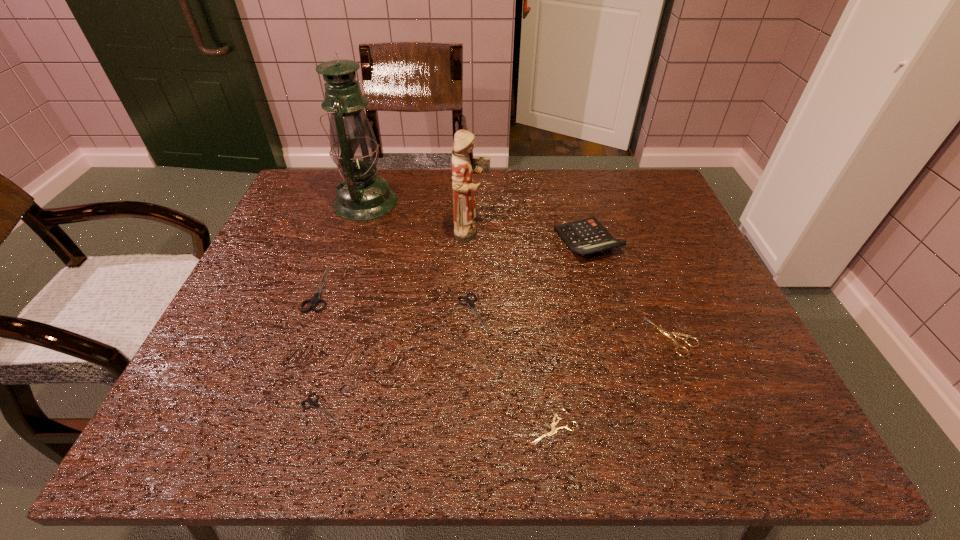
The width and height of the screenshot is (960, 540). Find the location of `free spot located on the left of the smaller beige shears`. free spot located on the left of the smaller beige shears is located at coordinates [502, 427].

At what (x,y) coordinates should I click in order to perform the action: click on object located in the far edge section of the desktop. Please return your answer as a coordinate pair (x, y). This screenshot has width=960, height=540. Looking at the image, I should click on (362, 195).

I want to click on oil lamp that is at the left edge, so click(x=362, y=195).

Image resolution: width=960 pixels, height=540 pixels. Find the location of `shears present at the left edge`. shears present at the left edge is located at coordinates (316, 299).

The image size is (960, 540). I want to click on object present at the right edge, so click(x=669, y=335).

Where is `object that is at the far left corner`? This screenshot has width=960, height=540. object that is at the far left corner is located at coordinates (362, 195).

This screenshot has height=540, width=960. I want to click on vacant region at the far edge of the desktop, so click(x=408, y=193).

Locate an element on the screen. The height and width of the screenshot is (540, 960). vacant space at the near edge of the desktop is located at coordinates (380, 442).

In order to click on vacant space at the left edge in this screenshot , I will do `click(309, 279)`.

The image size is (960, 540). I want to click on free spot at the right edge of the desktop, so (713, 383).